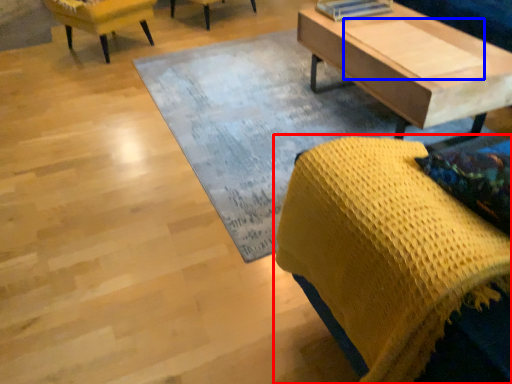
Question: Which object is further to the camera taking this photo, chair (highlighted by a red box) or plank (highlighted by a blue box)?

Choices:
 (A) chair
 (B) plank

Answer: (B)